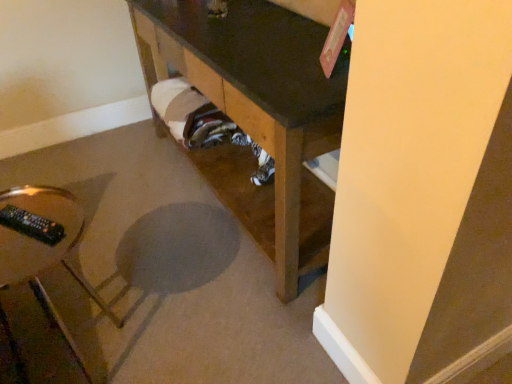
Find the location of a particular element. Image resolution: width=512 pixels, height=384 pixels. free region under clear glass remote control at lower left, the first furniture when ordered from left to right (from a real-world perspective) is located at coordinates (87, 352).